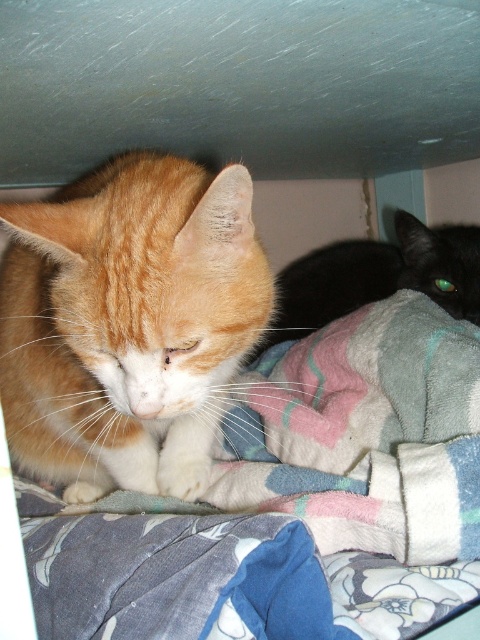
Is point (55, 332) closer to camera compared to point (452, 301)?

Yes, it is.

Does orange fur cat at center have a lesser height compared to black glossy cat at lower right?

Incorrect, orange fur cat at center's height does not fall short of black glossy cat at lower right's.

Image resolution: width=480 pixels, height=640 pixels. Describe the element at coordinates (129, 323) in the screenshot. I see `orange fur cat at center` at that location.

What are the coordinates of `orange fur cat at center` in the screenshot? It's located at (129, 323).

Who is positioned more to the left, fluffy multicolored blanket at center or orange fur cat at center?

From the viewer's perspective, orange fur cat at center appears more on the left side.

Does fluffy multicolored blanket at center come behind orange fur cat at center?

No, fluffy multicolored blanket at center is in front of orange fur cat at center.

Locate an element on the screen. Image resolution: width=480 pixels, height=640 pixels. fluffy multicolored blanket at center is located at coordinates (294, 500).

The width and height of the screenshot is (480, 640). I want to click on fluffy multicolored blanket at center, so click(x=294, y=500).

Between fluffy multicolored blanket at center and black glossy cat at lower right, which one is positioned lower?

Positioned lower is fluffy multicolored blanket at center.

Can you confirm if fluffy multicolored blanket at center is shorter than black glossy cat at lower right?

No, fluffy multicolored blanket at center is not shorter than black glossy cat at lower right.

Who is more forward, [362,349] or [457,230]?

Point [362,349] is more forward.

The width and height of the screenshot is (480, 640). What are the coordinates of `fluffy multicolored blanket at center` in the screenshot? It's located at (294, 500).